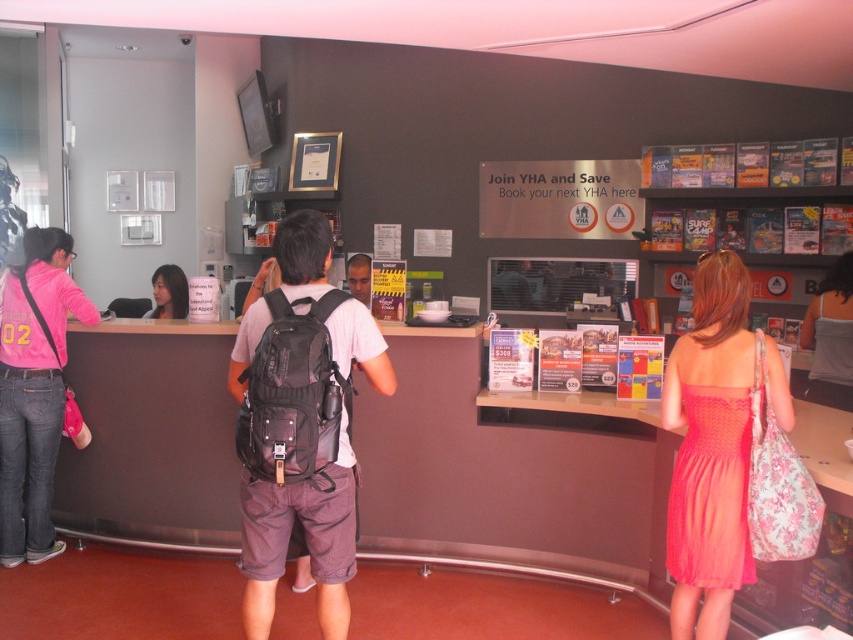
You are organizing a fashion show and need to determine which dress takes up more space on the runway. Based on the image, which dress between the matte coral dress at center and the pink satin dress at center is bigger in size?

The matte coral dress at center has a larger size compared to the pink satin dress at center, so it takes up more space on the runway.